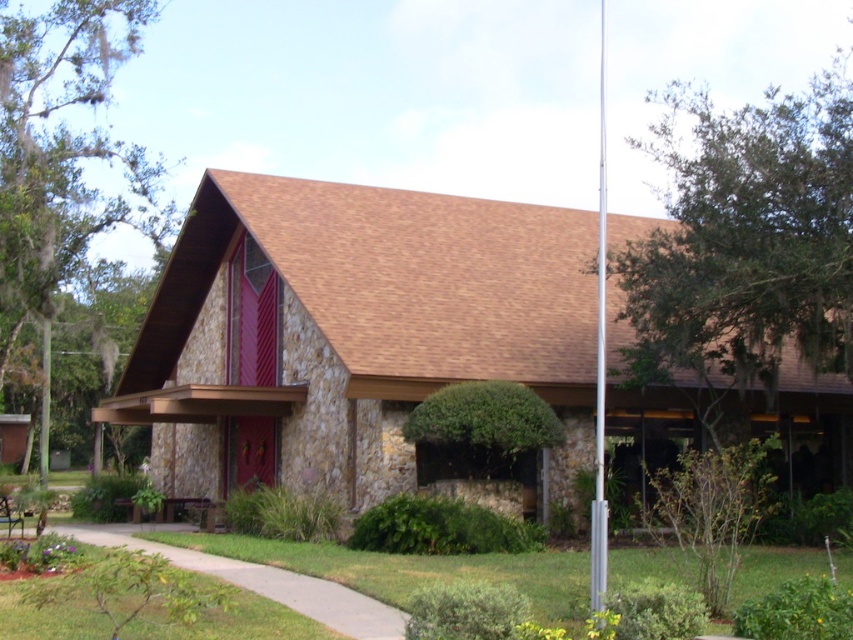
You are standing in front of the brown stone church at center and the silver metallic flag pole at center. Which object appears larger in the scene?

The silver metallic flag pole at center appears larger than the brown stone church at center.

You are standing in front of the brown stone church at center and want to take a photo of the red doors. The green leafy tree at upper right is blocking your view. How can you adjust your position to avoid the tree?

The green leafy tree at upper right is behind the brown stone church at center, so you can move to the left side of the entrance to avoid the tree blocking the view of the red doors.